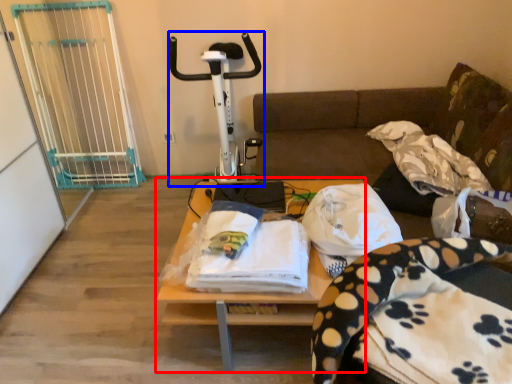
Question: Which object appears closest to the camera in this image, table (highlighted by a red box) or sport equipment (highlighted by a blue box)?

Choices:
 (A) table
 (B) sport equipment

Answer: (A)